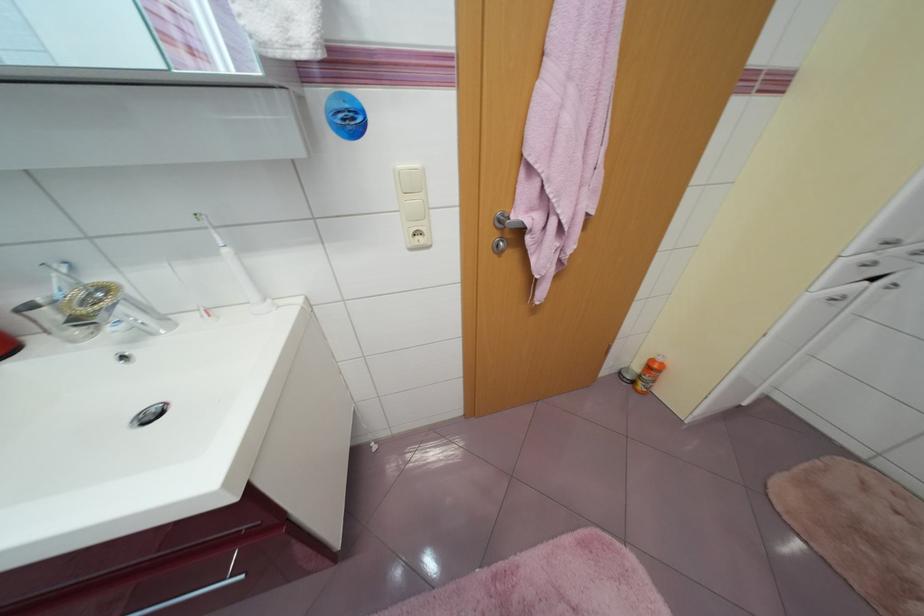
Where would you pull the silver cabinet handle? Please return your answer as a coordinate pair (x, y).

(188, 594)